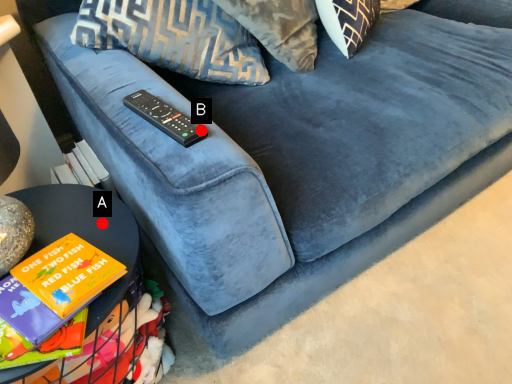
Question: Two points are circled on the image, labeled by A and B beside each circle. Which point appears closest to the camera in this image?

Choices:
 (A) A is closer
 (B) B is closer

Answer: (B)